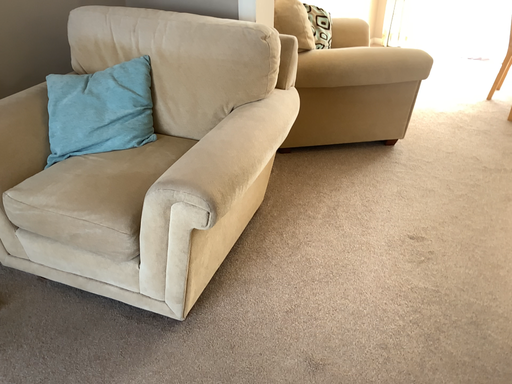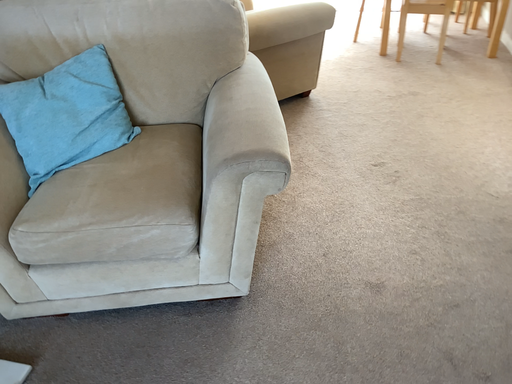
Question: How did the camera likely rotate when shooting the video?

Choices:
 (A) rotated left
 (B) rotated right

Answer: (B)